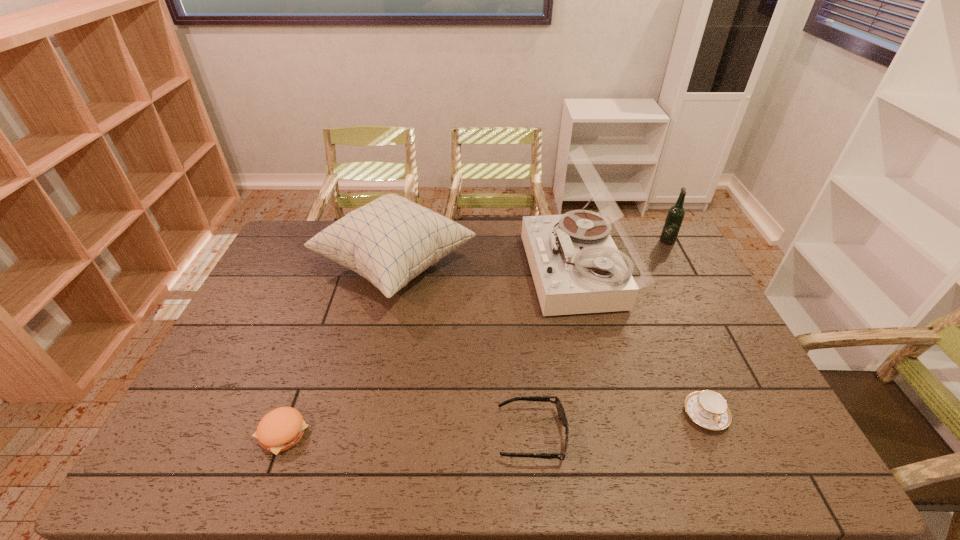
Identify the location of the tallest object. (576, 267).

In order to click on cushion in this screenshot , I will do `click(391, 240)`.

Image resolution: width=960 pixels, height=540 pixels. Identify the location of the rightmost object. (675, 216).

I want to click on teacup, so click(x=709, y=409).

This screenshot has width=960, height=540. I want to click on sunglasses, so click(x=560, y=409).

Identify the location of patty. (280, 429).

Where is `blank area located on the left of the record player`? The height and width of the screenshot is (540, 960). blank area located on the left of the record player is located at coordinates (431, 272).

Image resolution: width=960 pixels, height=540 pixels. In order to click on free location located 0.150m on the right of the cushion in this screenshot , I will do `click(517, 266)`.

The image size is (960, 540). Identify the location of free space located on the front of the rightmost object. (693, 288).

Locate an element on the screen. free space located 0.070m on the side with the handle of the teacup is located at coordinates (726, 462).